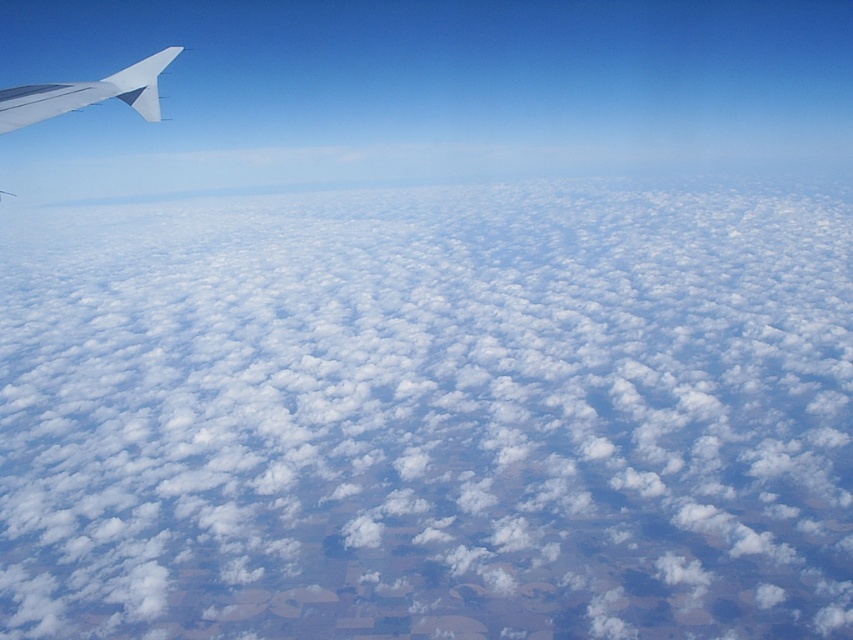
You are a pilot observing the view from the cockpit window. You notice the white fluffy cloud at upper left and the metallic silver wing at upper left. Which object appears taller in the image?

The white fluffy cloud at upper left appears taller than the metallic silver wing at upper left based on their depiction in the scene.

You are a passenger looking out the airplane window. You see the white fluffy cloud at upper left and the metallic silver wing at upper left. Which object is closer to the left edge of the window?

The white fluffy cloud at upper left is more on the left side of the metallic silver wing at upper left, so it is closer to the left edge of the window.